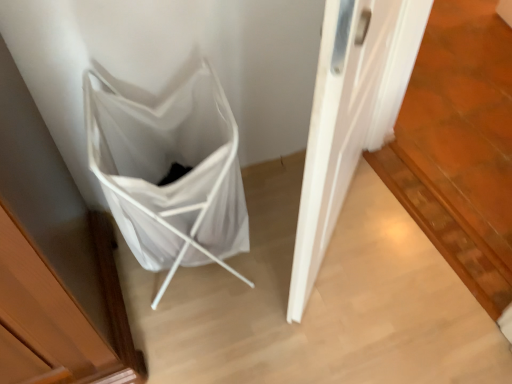
Question: Does white fabric folding chair at lower left have a larger size compared to white matte door at center?

Choices:
 (A) yes
 (B) no

Answer: (B)

Question: From a real-world perspective, does white fabric folding chair at lower left sit lower than white matte door at center?

Choices:
 (A) no
 (B) yes

Answer: (B)

Question: Is white fabric folding chair at lower left further to camera compared to white matte door at center?

Choices:
 (A) no
 (B) yes

Answer: (B)

Question: Could you tell me if white fabric folding chair at lower left is turned towards white matte door at center?

Choices:
 (A) yes
 (B) no

Answer: (B)

Question: Is white fabric folding chair at lower left in front of white matte door at center?

Choices:
 (A) no
 (B) yes

Answer: (A)

Question: From the image's perspective, is white fabric folding chair at lower left on top of white matte door at center?

Choices:
 (A) no
 (B) yes

Answer: (A)

Question: From the image's perspective, would you say white matte door at center is positioned over white fabric folding chair at lower left?

Choices:
 (A) no
 (B) yes

Answer: (B)

Question: Considering the relative sizes of white matte door at center and white fabric folding chair at lower left in the image provided, is white matte door at center bigger than white fabric folding chair at lower left?

Choices:
 (A) no
 (B) yes

Answer: (B)

Question: Is white matte door at center far away from white fabric folding chair at lower left?

Choices:
 (A) no
 (B) yes

Answer: (A)

Question: Does white matte door at center appear on the left side of white fabric folding chair at lower left?

Choices:
 (A) yes
 (B) no

Answer: (B)

Question: Considering the relative sizes of white matte door at center and white fabric folding chair at lower left in the image provided, is white matte door at center shorter than white fabric folding chair at lower left?

Choices:
 (A) yes
 (B) no

Answer: (B)

Question: Is white matte door at center positioned with its back to white fabric folding chair at lower left?

Choices:
 (A) yes
 (B) no

Answer: (A)

Question: Considering the positions of white matte door at center and white fabric folding chair at lower left in the image, is white matte door at center bigger or smaller than white fabric folding chair at lower left?

Choices:
 (A) big
 (B) small

Answer: (A)